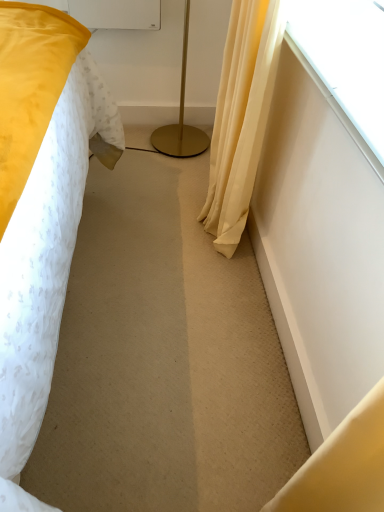
Question: Is transparent glass window at upper right spatially inside silky yellow curtain at right, or outside of it?

Choices:
 (A) inside
 (B) outside

Answer: (B)

Question: Is transparent glass window at upper right bigger or smaller than silky yellow curtain at right?

Choices:
 (A) small
 (B) big

Answer: (A)

Question: Considering the real-world distances, which object is closest to the gold metallic floor lamp at center?

Choices:
 (A) silky yellow curtain at right
 (B) transparent glass window at upper right

Answer: (A)

Question: Based on their relative distances, which object is farther from the gold metallic floor lamp at center?

Choices:
 (A) silky yellow curtain at right
 (B) transparent glass window at upper right

Answer: (B)